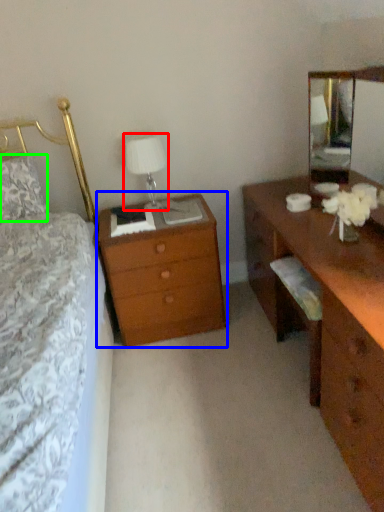
Question: Which object is positioned farthest from table lamp (highlighted by a red box)? Select from nightstand (highlighted by a blue box) and pillow (highlighted by a green box).

Choices:
 (A) nightstand
 (B) pillow

Answer: (B)